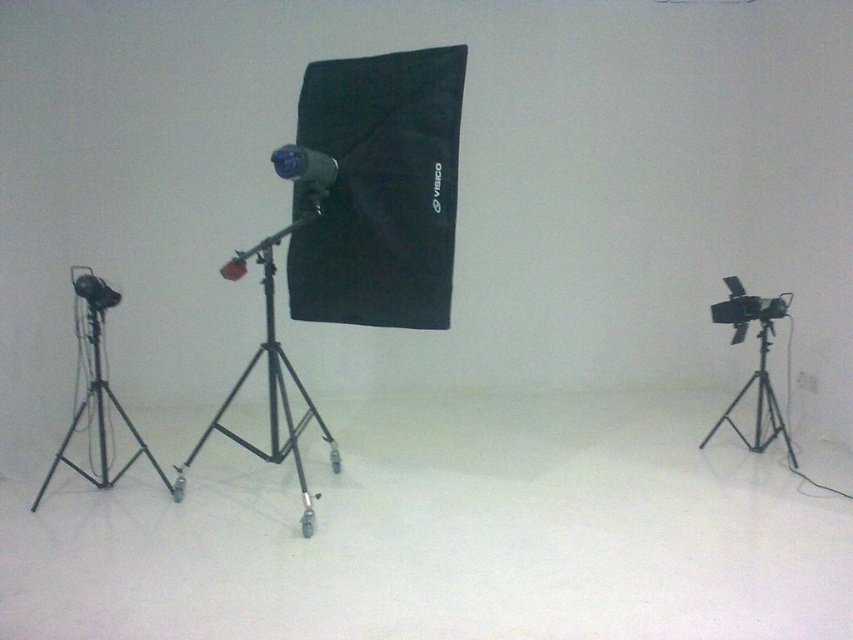
Question: Which object is farther from the camera taking this photo?

Choices:
 (A) black matte tripod at center
 (B) matte black tripod at right
 (C) black matte tripod at right
 (D) matte black tripod at left

Answer: (C)

Question: Does matte black tripod at left lie behind matte black tripod at right?

Choices:
 (A) yes
 (B) no

Answer: (B)

Question: Which point appears farthest from the camera in this image?

Choices:
 (A) (99, 384)
 (B) (177, 481)
 (C) (764, 337)

Answer: (C)

Question: Where is matte black tripod at right located in relation to black matte tripod at right in the image?

Choices:
 (A) right
 (B) left

Answer: (A)

Question: Can you confirm if matte black tripod at right is positioned above matte black camera at center?

Choices:
 (A) no
 (B) yes

Answer: (A)

Question: Which of the following is the closest to the observer?

Choices:
 (A) matte black camera at center
 (B) black matte tripod at right

Answer: (A)